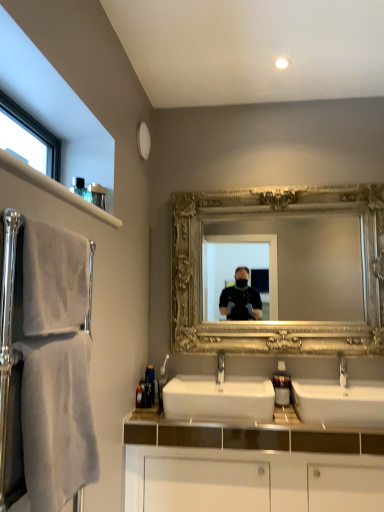
Where is `white soft towel at left, acting as the 1th bath towel starting from the bottom`? white soft towel at left, acting as the 1th bath towel starting from the bottom is located at coordinates (56, 366).

Measure the distance between point (x=83, y=270) and camera.

1.18 meters.

This screenshot has height=512, width=384. Describe the element at coordinates (283, 321) in the screenshot. I see `gold ornate mirror at center` at that location.

What do you see at coordinates (219, 397) in the screenshot? The image size is (384, 512). I see `white ceramic sink at center, which appears as the second sink when viewed from the right` at bounding box center [219, 397].

Measure the distance between point (206, 490) and camera.

6.53 feet.

This screenshot has width=384, height=512. I want to click on silver metallic faucet at center, so click(343, 371).

Consider the image. Is clear glass window at upper left with white ceramic sink at center, which is counted as the 1th sink, starting from the left?

No, clear glass window at upper left is not next to white ceramic sink at center, which is counted as the 1th sink, starting from the left.

Is clear glass window at upper left wider than white ceramic sink at center, which is counted as the 1th sink, starting from the left?

In fact, clear glass window at upper left might be narrower than white ceramic sink at center, which is counted as the 1th sink, starting from the left.

Is point (24, 135) closer to camera compared to point (245, 391)?

That is True.

From a real-world perspective, relative to translucent plastic soap dispenser at center, is clear glass window at upper left vertically above or below?

Clearly, from a real-world perspective, clear glass window at upper left is above translucent plastic soap dispenser at center.

Between clear glass window at upper left and translucent plastic soap dispenser at center, which one is positioned in front?

clear glass window at upper left is closer to the camera.

Is point (6, 95) positioned after point (282, 367)?

No, (6, 95) is in front of (282, 367).

In terms of size, does clear glass window at upper left appear bigger or smaller than translucent plastic soap dispenser at center?

A: Clearly, clear glass window at upper left is larger in size than translucent plastic soap dispenser at center.

Which point is more distant from viewer, (x=327, y=389) or (x=284, y=365)?

The point (x=284, y=365) is behind.

In terms of size, does white ceramic sink at center, which is the second sink from left to right, appear bigger or smaller than translucent plastic soap dispenser at center?

Clearly, white ceramic sink at center, which is the second sink from left to right, is larger in size than translucent plastic soap dispenser at center.

Is white ceramic sink at center, which is counted as the 1th sink, starting from the right, not near translucent plastic soap dispenser at center?

No, white ceramic sink at center, which is counted as the 1th sink, starting from the right, is not far from translucent plastic soap dispenser at center.

From the picture: From the image's perspective, is white ceramic sink at center, which is the second sink from left to right, located above or below translucent plastic soap dispenser at center?

white ceramic sink at center, which is the second sink from left to right, is situated lower than translucent plastic soap dispenser at center in the image.

Is point (215, 439) positioned behind point (343, 379)?

No, it is in front of (343, 379).

Can you confirm if white glossy cabinet at center is positioned to the left of silver metallic faucet at center?

Correct, you'll find white glossy cabinet at center to the left of silver metallic faucet at center.

Considering the relative sizes of white glossy cabinet at center and silver metallic faucet at center in the image provided, is white glossy cabinet at center wider than silver metallic faucet at center?

Correct, the width of white glossy cabinet at center exceeds that of silver metallic faucet at center.

Would you say white glossy cabinet at center is inside or outside silver metallic faucet at center?

white glossy cabinet at center is not inside silver metallic faucet at center, it's outside.

From a real-world perspective, is matte brown soap dispenser at lower left, which is the 2th toiletry from back to front, physically above silver metallic faucet at center?

No, from a real-world perspective, matte brown soap dispenser at lower left, which is the 2th toiletry from back to front, is not above silver metallic faucet at center.

Is silver metallic faucet at center surrounded by matte brown soap dispenser at lower left, which is the 2th toiletry from back to front?

No, silver metallic faucet at center is not inside matte brown soap dispenser at lower left, which is the 2th toiletry from back to front.

From the image's perspective, does matte brown soap dispenser at lower left, acting as the 1th toiletry starting from the front, appear lower than silver metallic faucet at center?

Yes.

In the scene shown: Considering the positions of objects matte brown soap dispenser at lower left, which is the 2th toiletry from back to front, and silver metallic faucet at center in the image provided, who is behind, matte brown soap dispenser at lower left, which is the 2th toiletry from back to front, or silver metallic faucet at center?

silver metallic faucet at center.

Is white ceramic sink at center, which is counted as the 1th sink, starting from the right, at the left side of white soft towel at left, marked as the 2th bath towel in a top-to-bottom arrangement?

No, white ceramic sink at center, which is counted as the 1th sink, starting from the right, is not to the left of white soft towel at left, marked as the 2th bath towel in a top-to-bottom arrangement.

Does white ceramic sink at center, which is counted as the 1th sink, starting from the right, have a smaller size compared to white soft towel at left, acting as the 1th bath towel starting from the bottom?

No.

Is white ceramic sink at center, which is counted as the 1th sink, starting from the right, inside the boundaries of white soft towel at left, marked as the 2th bath towel in a top-to-bottom arrangement, or outside?

white ceramic sink at center, which is counted as the 1th sink, starting from the right, is not inside white soft towel at left, marked as the 2th bath towel in a top-to-bottom arrangement, it's outside.

From the picture: What's the angular difference between white ceramic sink at center, which is the second sink from left to right, and white soft towel at left, marked as the 2th bath towel in a top-to-bottom arrangement,'s facing directions?

There is a 92.7-degree angle between the facing directions of white ceramic sink at center, which is the second sink from left to right, and white soft towel at left, marked as the 2th bath towel in a top-to-bottom arrangement.

Does clear glass window at upper left contain white glossy cabinet at center?

That's incorrect, white glossy cabinet at center is not inside clear glass window at upper left.

Considering the positions of objects clear glass window at upper left and white glossy cabinet at center in the image provided, who is in front, clear glass window at upper left or white glossy cabinet at center?

clear glass window at upper left is in front.

At what (x,y) coordinates should I click in order to perform the action: click on window that appears above the white glossy cabinet at center (from the image's perspective). Please return your answer as a coordinate pair (x, y). Looking at the image, I should click on (28, 138).

Can you tell me how much clear glass window at upper left and white glossy cabinet at center differ in facing direction?

89.2 degrees.

You are a GUI agent. You are given a task and a screenshot of the screen. Output one action in this format:
    pyautogui.click(x=<x>, y=<y>)
    Task: Click on the sink that is the 1st one when counting rightward from the clear glass window at upper left
    
    Given the screenshot: What is the action you would take?
    pyautogui.click(x=219, y=397)

Where is `window in front of the translucent plastic soap dispenser at center`? window in front of the translucent plastic soap dispenser at center is located at coordinates (28, 138).

From the image, which object appears to be farther from gold ornate mirror at center, white ceramic sink at center, which appears as the second sink when viewed from the right, or translucent plastic soap dispenser at center?

translucent plastic soap dispenser at center lies further to gold ornate mirror at center than the other object.

Looking at the image, which one is located further to gold ornate mirror at center, clear glass window at upper left or white textured towel at left, the 1th bath towel in the top-to-bottom sequence?

white textured towel at left, the 1th bath towel in the top-to-bottom sequence.

Looking at the image, which one is located further to silver metallic faucet at center, white soft towel at left, marked as the 2th bath towel in a top-to-bottom arrangement, or gold ornate mirror at center?

white soft towel at left, marked as the 2th bath towel in a top-to-bottom arrangement, is further to silver metallic faucet at center.

Which object lies further to the anchor point matte brown soap dispenser at lower left, which is the 2th toiletry from back to front, clear glass window at upper left or gold ornate mirror at center?

clear glass window at upper left lies further to matte brown soap dispenser at lower left, which is the 2th toiletry from back to front, than the other object.

When comparing their distances from white ceramic sink at center, which is counted as the 1th sink, starting from the right, does white glossy cabinet at center or gold ornate mirror at center seem further?

The object further to white ceramic sink at center, which is counted as the 1th sink, starting from the right, is gold ornate mirror at center.

Which object lies nearer to the anchor point white ceramic sink at center, which appears as the second sink when viewed from the right, white textured towel at left, the 1th bath towel in the top-to-bottom sequence, or translucent plastic bottle at lower left, which ranks as the second toiletry in front-to-back order?

translucent plastic bottle at lower left, which ranks as the second toiletry in front-to-back order, is positioned closer to the anchor white ceramic sink at center, which appears as the second sink when viewed from the right.

Estimate the real-world distances between objects in this image. Which object is further from white soft towel at left, marked as the 2th bath towel in a top-to-bottom arrangement, white textured towel at left, which is counted as the 2th bath towel, starting from the bottom, or translucent plastic soap dispenser at center?

translucent plastic soap dispenser at center.

When comparing their distances from matte brown soap dispenser at lower left, acting as the 1th toiletry starting from the front, does white ceramic sink at center, which is counted as the 1th sink, starting from the left, or white glossy cabinet at center seem further?

white glossy cabinet at center is further to matte brown soap dispenser at lower left, acting as the 1th toiletry starting from the front.

This screenshot has height=512, width=384. I want to click on soap dispenser between clear glass window at upper left and white glossy cabinet at center vertically, so [282, 385].

You are a GUI agent. You are given a task and a screenshot of the screen. Output one action in this format:
    pyautogui.click(x=<x>, y=<y>)
    Task: Click on the toiletry that lies between clear glass window at upper left and matte brown soap dispenser at lower left, acting as the 1th toiletry starting from the front, from top to bottom
    This screenshot has width=384, height=512.
    Given the screenshot: What is the action you would take?
    pyautogui.click(x=150, y=380)

You are a GUI agent. You are given a task and a screenshot of the screen. Output one action in this format:
    pyautogui.click(x=<x>, y=<y>)
    Task: Click on the soap dispenser that lies between clear glass window at upper left and white ceramic sink at center, which appears as the second sink when viewed from the right, from top to bottom
    
    Given the screenshot: What is the action you would take?
    pyautogui.click(x=282, y=385)

This screenshot has height=512, width=384. Identify the location of bathroom cabinet between white textured towel at left, the 1th bath towel in the top-to-bottom sequence, and white ceramic sink at center, which is counted as the 1th sink, starting from the left, along the z-axis. (250, 465).